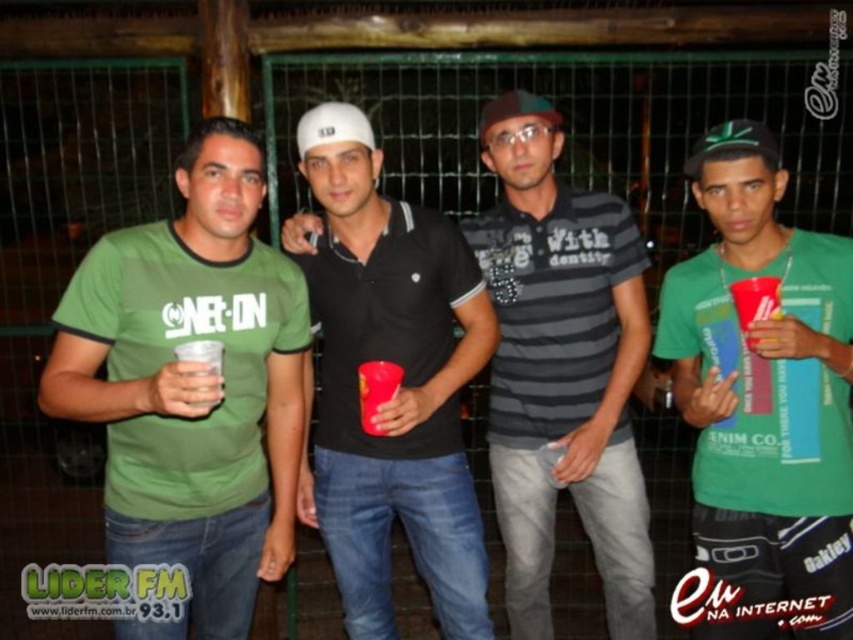
Is green matte t-shirt at center smaller than black cotton polo shirt at center?

Correct, green matte t-shirt at center occupies less space than black cotton polo shirt at center.

At what (x,y) coordinates should I click in order to perform the action: click on green matte t-shirt at center. Please return your answer as a coordinate pair (x, y). Looking at the image, I should click on (763, 403).

Image resolution: width=853 pixels, height=640 pixels. I want to click on green matte t-shirt at center, so click(x=763, y=403).

Does green matte t-shirt at center lie behind matte plastic cup at center?

No.

At what (x,y) coordinates should I click in order to perform the action: click on green matte t-shirt at center. Please return your answer as a coordinate pair (x, y). Image resolution: width=853 pixels, height=640 pixels. Looking at the image, I should click on (763, 403).

Can you confirm if striped cotton shirt at center is positioned to the left of matte plastic cup at right?

Yes, striped cotton shirt at center is to the left of matte plastic cup at right.

Does point (525, 368) come behind point (775, 308)?

Yes, it is.

Is point (532, 104) closer to viewer compared to point (737, 316)?

No, it is behind (737, 316).

The width and height of the screenshot is (853, 640). In order to click on striped cotton shirt at center in this screenshot , I will do (561, 369).